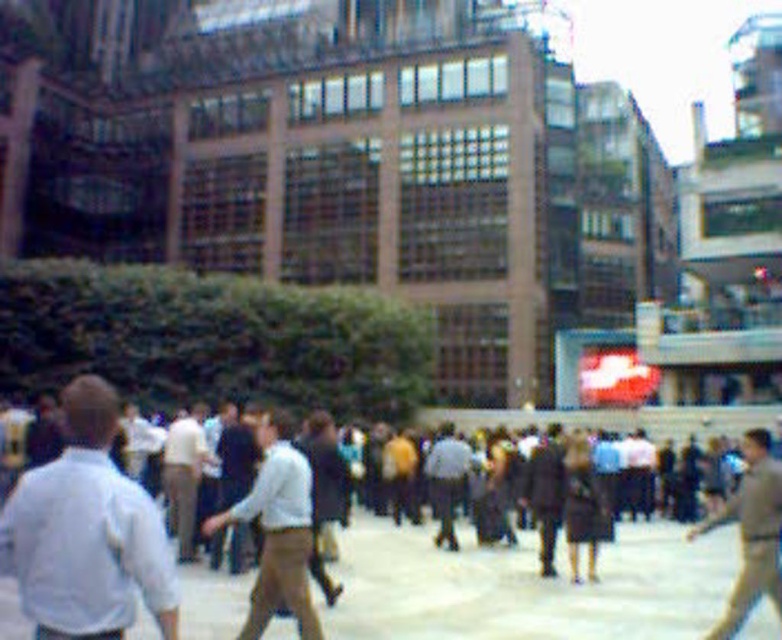
Question: Which object appears farthest from the camera in this image?

Choices:
 (A) light blue shirt at left
 (B) light blue shirt at center
 (C) brown fabric crowd at center

Answer: (B)

Question: Is light blue shirt at left positioned behind light brown leather jacket at center?

Choices:
 (A) yes
 (B) no

Answer: (B)

Question: Among these points, which one is nearest to the camera?

Choices:
 (A) (680, 541)
 (B) (178, 449)
 (C) (755, 598)

Answer: (C)

Question: Can you confirm if brown fabric crowd at center is thinner than light brown leather pants at center?

Choices:
 (A) yes
 (B) no

Answer: (B)

Question: Observing the image, what is the correct spatial positioning of brown fabric crowd at center in reference to light beige pants at center?

Choices:
 (A) right
 (B) left

Answer: (A)

Question: Which point is farther from the camera taking this photo?

Choices:
 (A) (257, 435)
 (B) (443, 538)

Answer: (B)